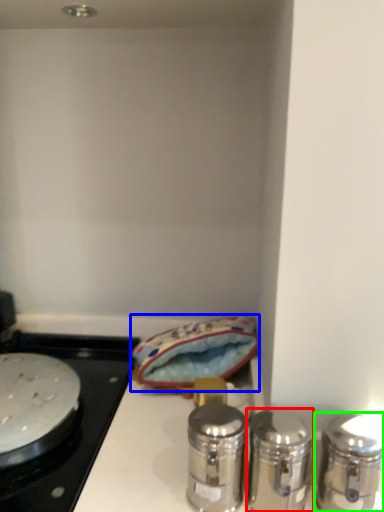
Question: Which object is positioned farthest from salt and pepper shakers (highlighted by a red box)? Select from material (highlighted by a blue box) and salt and pepper shakers (highlighted by a green box).

Choices:
 (A) material
 (B) salt and pepper shakers

Answer: (A)